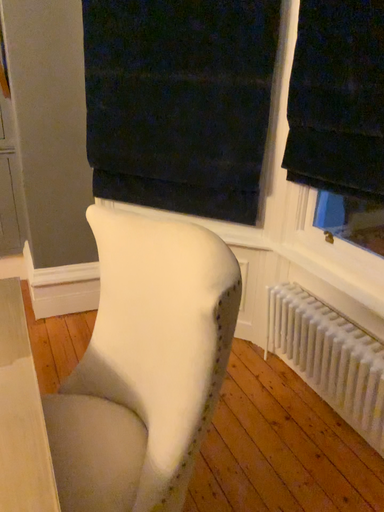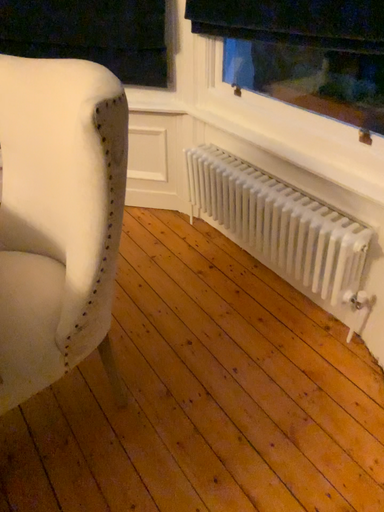
Question: Which way did the camera rotate in the video?

Choices:
 (A) rotated right
 (B) rotated left

Answer: (A)